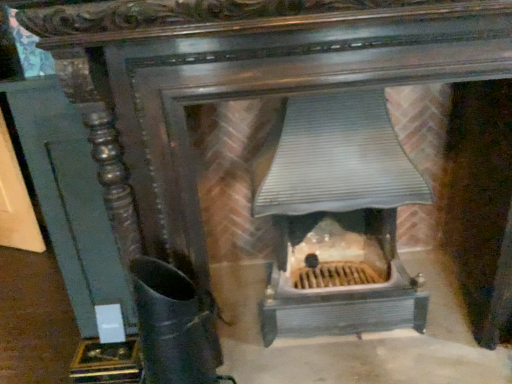
Question: Is metallic gray heater at center far from black matte boot at lower left?

Choices:
 (A) yes
 (B) no

Answer: (B)

Question: Is the surface of metallic gray heater at center in direct contact with black matte boot at lower left?

Choices:
 (A) yes
 (B) no

Answer: (B)

Question: From a real-world perspective, is metallic gray heater at center located beneath black matte boot at lower left?

Choices:
 (A) yes
 (B) no

Answer: (B)

Question: Does metallic gray heater at center have a larger size compared to black matte boot at lower left?

Choices:
 (A) no
 (B) yes

Answer: (B)

Question: Is metallic gray heater at center taller than black matte boot at lower left?

Choices:
 (A) no
 (B) yes

Answer: (B)

Question: Is metallic gray heater at center positioned with its back to black matte boot at lower left?

Choices:
 (A) yes
 (B) no

Answer: (B)

Question: Is black matte boot at lower left not within metallic gray heater at center?

Choices:
 (A) yes
 (B) no

Answer: (A)

Question: Is metallic gray heater at center surrounded by black matte boot at lower left?

Choices:
 (A) no
 (B) yes

Answer: (A)

Question: Is black matte boot at lower left at the right side of metallic gray heater at center?

Choices:
 (A) yes
 (B) no

Answer: (B)

Question: Is the position of black matte boot at lower left less distant than that of metallic gray heater at center?

Choices:
 (A) no
 (B) yes

Answer: (B)

Question: Is black matte boot at lower left not near metallic gray heater at center?

Choices:
 (A) no
 (B) yes

Answer: (A)

Question: Considering the relative sizes of black matte boot at lower left and metallic gray heater at center in the image provided, is black matte boot at lower left taller than metallic gray heater at center?

Choices:
 (A) yes
 (B) no

Answer: (B)

Question: Relative to metallic gray heater at center, is black matte boot at lower left in front or behind?

Choices:
 (A) behind
 (B) front

Answer: (B)